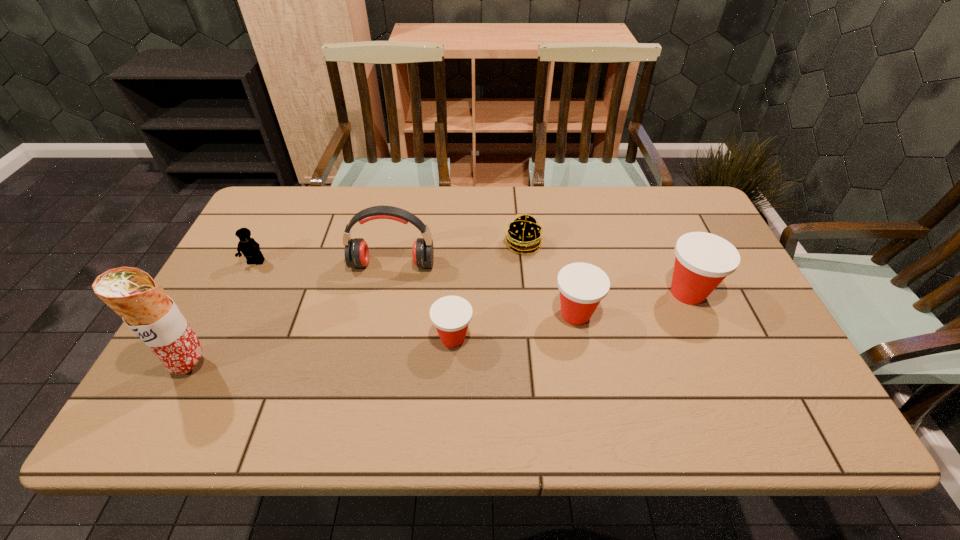
The image size is (960, 540). Find the location of `vacant spot to place a Dixie cup on the left`. vacant spot to place a Dixie cup on the left is located at coordinates pyautogui.click(x=318, y=364).